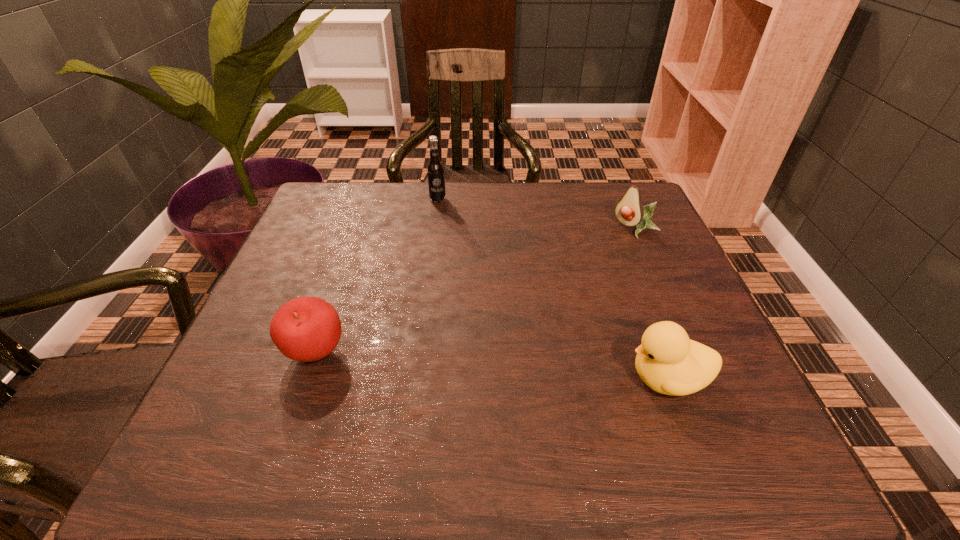
Where is `vacant spot on the desktop that is between the apple and the duck and is positioned on the label of the second object from left to right`? Image resolution: width=960 pixels, height=540 pixels. vacant spot on the desktop that is between the apple and the duck and is positioned on the label of the second object from left to right is located at coordinates (507, 367).

At what (x,y) coordinates should I click in order to perform the action: click on vacant spot on the desktop that is between the apple and the duck and is positioned on the seed side of the avocado. Please return your answer as a coordinate pair (x, y). This screenshot has width=960, height=540. Looking at the image, I should click on (484, 366).